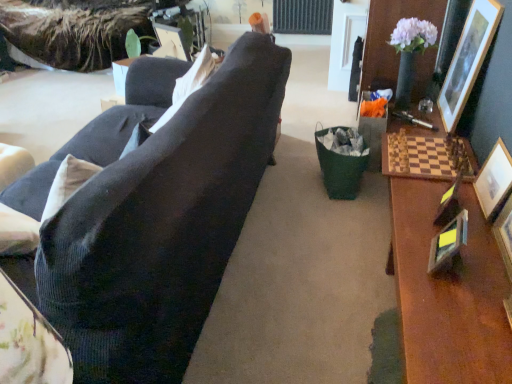
Question: From the image's perspective, is white fabric pillow at upper center under metallic silver picture frame at right, the second picture frame viewed from the left?

Choices:
 (A) no
 (B) yes

Answer: (A)

Question: Is white fabric pillow at upper center completely or partially outside of metallic silver picture frame at right, the second picture frame viewed from the left?

Choices:
 (A) yes
 (B) no

Answer: (A)

Question: Can you confirm if white fabric pillow at upper center is smaller than metallic silver picture frame at right, the second picture frame viewed from the left?

Choices:
 (A) yes
 (B) no

Answer: (B)

Question: Is white fabric pillow at upper center positioned in front of metallic silver picture frame at right, the second picture frame viewed from the left?

Choices:
 (A) no
 (B) yes

Answer: (A)

Question: Is white fabric pillow at upper center thinner than metallic silver picture frame at right, the second picture frame viewed from the left?

Choices:
 (A) no
 (B) yes

Answer: (A)

Question: Considering the relative positions of metallic gold picture frame at right, placed as the 3th picture frame when sorted from left to right, and white fabric pillow at upper center in the image provided, is metallic gold picture frame at right, placed as the 3th picture frame when sorted from left to right, to the left or to the right of white fabric pillow at upper center?

Choices:
 (A) left
 (B) right

Answer: (B)

Question: Does point (438, 216) appear closer or farther from the camera than point (178, 82)?

Choices:
 (A) farther
 (B) closer

Answer: (B)

Question: In the image, is metallic gold picture frame at right, placed as the 3th picture frame when sorted from left to right, positioned in front of or behind white fabric pillow at upper center?

Choices:
 (A) front
 (B) behind

Answer: (A)

Question: Is metallic gold picture frame at right, placed as the 3th picture frame when sorted from left to right, inside the boundaries of white fabric pillow at upper center, or outside?

Choices:
 (A) inside
 (B) outside

Answer: (B)

Question: Considering the positions of matte plastic picture frame at upper center, acting as the sixth picture frame starting from the right, and metallic silver picture frame at right, the second picture frame viewed from the left, in the image, is matte plastic picture frame at upper center, acting as the sixth picture frame starting from the right, taller or shorter than metallic silver picture frame at right, the second picture frame viewed from the left,?

Choices:
 (A) tall
 (B) short

Answer: (A)

Question: Is matte plastic picture frame at upper center, acting as the sixth picture frame starting from the right, to the left or to the right of metallic silver picture frame at right, positioned as the fifth picture frame in right-to-left order, in the image?

Choices:
 (A) right
 (B) left

Answer: (B)

Question: In terms of width, does matte plastic picture frame at upper center, acting as the sixth picture frame starting from the right, look wider or thinner when compared to metallic silver picture frame at right, positioned as the fifth picture frame in right-to-left order?

Choices:
 (A) thin
 (B) wide

Answer: (B)

Question: Is matte plastic picture frame at upper center, acting as the sixth picture frame starting from the right, spatially inside metallic silver picture frame at right, positioned as the fifth picture frame in right-to-left order, or outside of it?

Choices:
 (A) inside
 (B) outside

Answer: (B)

Question: From a real-world perspective, is wooden picture frame at right, the 4th picture frame when ordered from left to right, positioned above or below wooden picture frame at upper right, arranged as the 6th picture frame when viewed from the left?

Choices:
 (A) below
 (B) above

Answer: (A)

Question: In the image, is wooden picture frame at right, the 4th picture frame when ordered from left to right, positioned in front of or behind wooden picture frame at upper right, arranged as the 6th picture frame when viewed from the left?

Choices:
 (A) behind
 (B) front

Answer: (B)